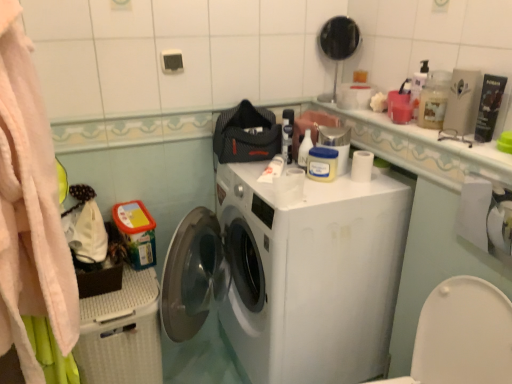
Find the location of `vacant space in front of translucent plastic bottle at upper right, which is the first cleaning product in right-to-left order`. vacant space in front of translucent plastic bottle at upper right, which is the first cleaning product in right-to-left order is located at coordinates (446, 140).